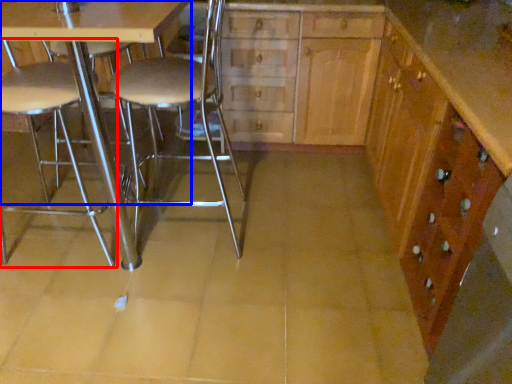
Question: Which of the following is the farthest to the observer, chair (highlighted by a red box) or table (highlighted by a blue box)?

Choices:
 (A) chair
 (B) table

Answer: (A)